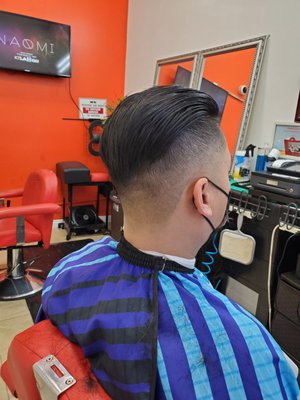
Find the location of a particular element. Image resolution: width=300 pixels, height=400 pixels. red chairs is located at coordinates (44, 178), (45, 340).